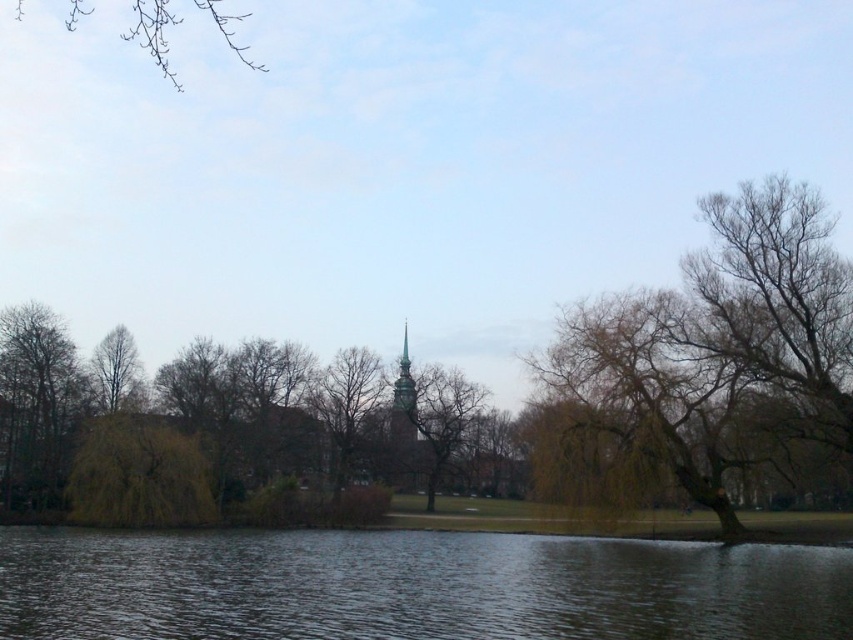
Can you confirm if bare wood tree at center is shorter than bare wood tree at left?

In fact, bare wood tree at center may be taller than bare wood tree at left.

Between point (337, 490) and point (106, 340), which one is positioned in front?

Point (337, 490) is in front.

This screenshot has height=640, width=853. What are the coordinates of `bare wood tree at center` in the screenshot? It's located at (346, 404).

Can you confirm if dark water at lower center is positioned below bare wood tree at center?

Correct, dark water at lower center is located below bare wood tree at center.

Can you confirm if dark water at lower center is thinner than bare wood tree at center?

No.

Image resolution: width=853 pixels, height=640 pixels. What are the coordinates of `dark water at lower center` in the screenshot? It's located at (412, 586).

Does brown textured tree at center have a larger size compared to bare wood tree at left?

Yes.

Does brown textured tree at center lie in front of bare wood tree at left?

No, it is not.

Who is more forward, (473, 381) or (106, 346)?

Point (106, 346) is in front.

Find the location of a particular element. The width and height of the screenshot is (853, 640). brown textured tree at center is located at coordinates (437, 412).